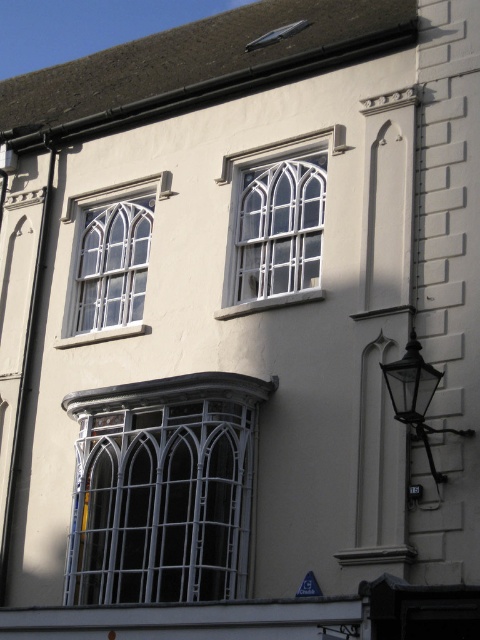
Is white glass window at upper center taller than black glass lamp at right?

Incorrect, white glass window at upper center's height is not larger of black glass lamp at right's.

Between white glass window at upper center and black glass lamp at right, which one has less height?

white glass window at upper center

Where is `white glass window at upper center`? The height and width of the screenshot is (640, 480). white glass window at upper center is located at coordinates tap(275, 224).

Who is positioned more to the right, white glass window at upper left or blue plastic sign at lower center?

Positioned to the right is blue plastic sign at lower center.

Image resolution: width=480 pixels, height=640 pixels. What do you see at coordinates (109, 260) in the screenshot?
I see `white glass window at upper left` at bounding box center [109, 260].

Describe the element at coordinates (109, 260) in the screenshot. Image resolution: width=480 pixels, height=640 pixels. I see `white glass window at upper left` at that location.

Find the location of a particular element. white glass window at upper left is located at coordinates (109, 260).

Between point (164, 564) and point (312, 577), which one is positioned in front?

Point (312, 577) is in front.

Where is `white metal window at center`? Image resolution: width=480 pixels, height=640 pixels. white metal window at center is located at coordinates (163, 490).